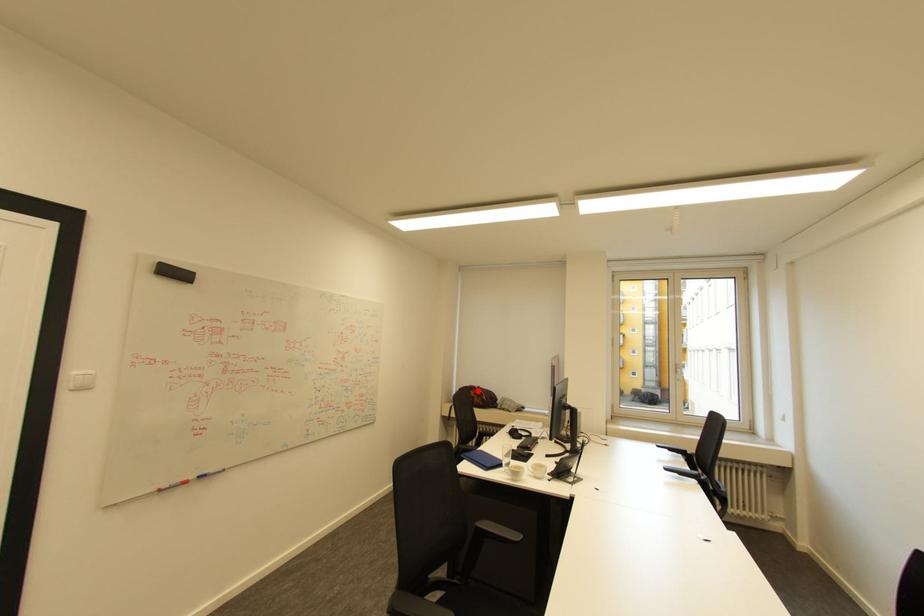
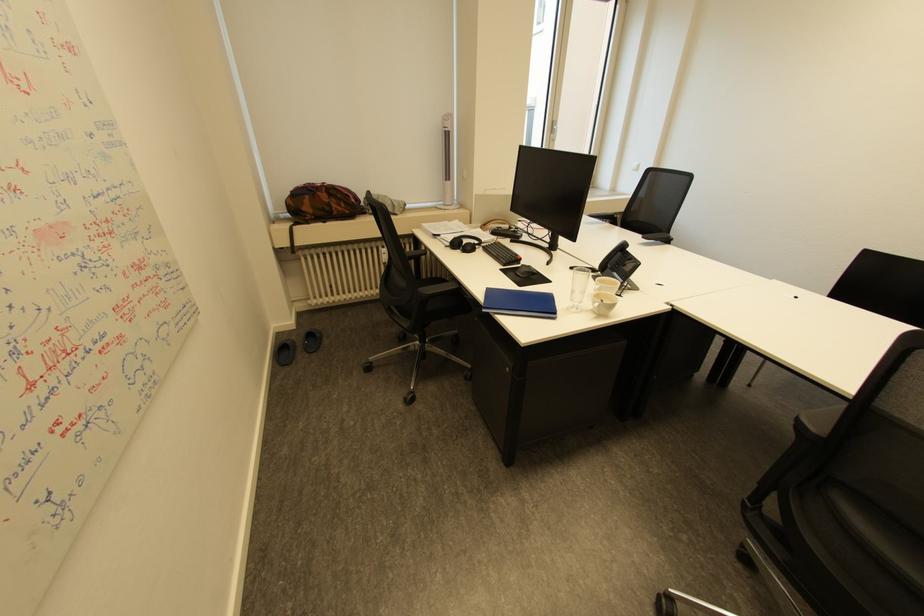
Find the pixel in the second image that matches the highlighted location in the first image.

(324, 193)